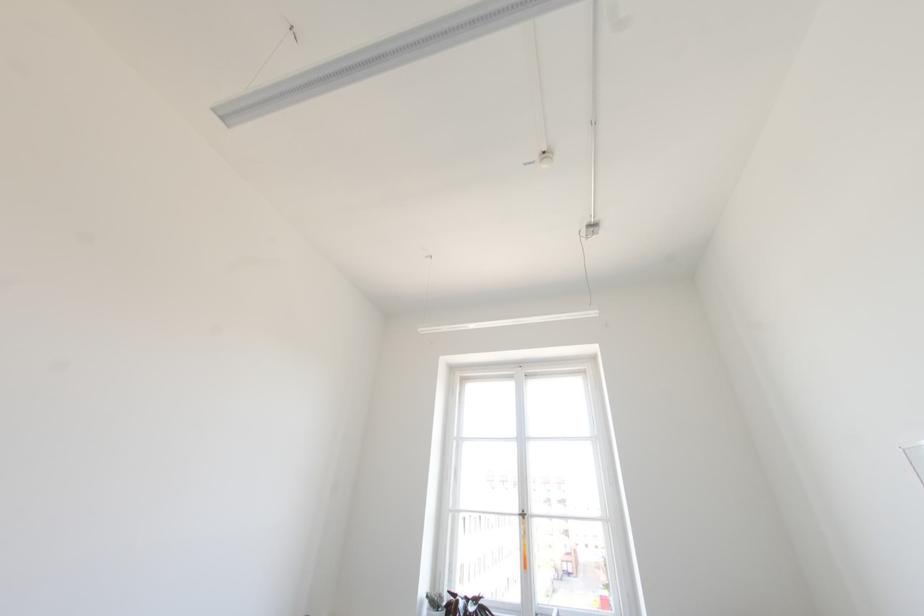
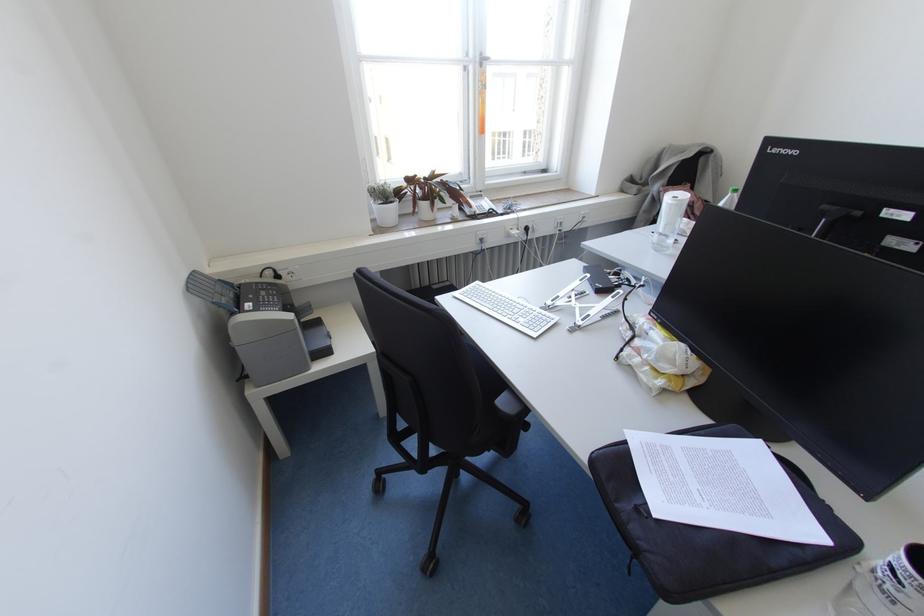
In the second image, find the point that corresponds to (523,517) in the first image.

(480, 65)